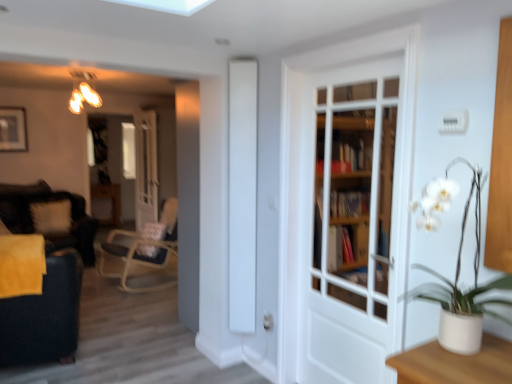
Question: From the image's perspective, is white glossy door at center, the second door in the front-to-back sequence, located above or below white fluffy pillow at left?

Choices:
 (A) below
 (B) above

Answer: (B)

Question: Considering the positions of white glossy door at center, positioned as the first door in left-to-right order, and white fluffy pillow at left in the image, is white glossy door at center, positioned as the first door in left-to-right order, taller or shorter than white fluffy pillow at left?

Choices:
 (A) tall
 (B) short

Answer: (A)

Question: Which is farther from the white fluffy pillow at left?

Choices:
 (A) white glossy screen door at center
 (B) white glossy door at center, placed as the 2th door when sorted from right to left
 (C) white wooden door at center, placed as the 1th door when sorted from front to back
 (D) velvet black swivel chair at left
 (E) white ceramic vase at right

Answer: (E)

Question: Which of these objects is positioned farthest from the white glossy door at center, positioned as the 1th door in back-to-front order?

Choices:
 (A) velvet black swivel chair at left
 (B) white glossy screen door at center
 (C) white fluffy pillow at left
 (D) white ceramic vase at right
 (E) white wooden door at center, the second door when ordered from left to right

Answer: (D)